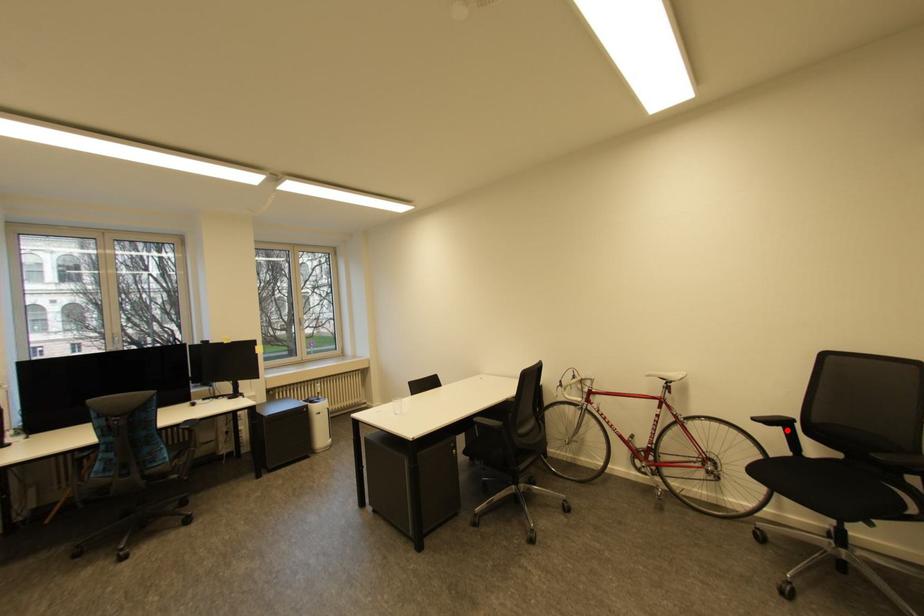
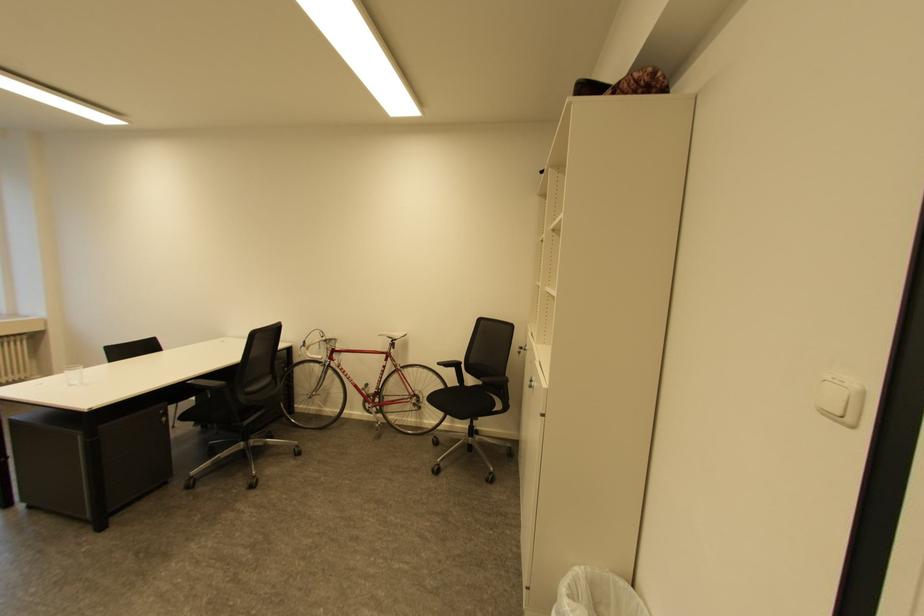
Question: I am providing you with two images of the same scene from different viewpoints. In image1, a red point is highlighted. Considering the same 3D point in image2, which of the following is correct?

Choices:
 (A) It is closer
 (B) It is farther

Answer: (B)